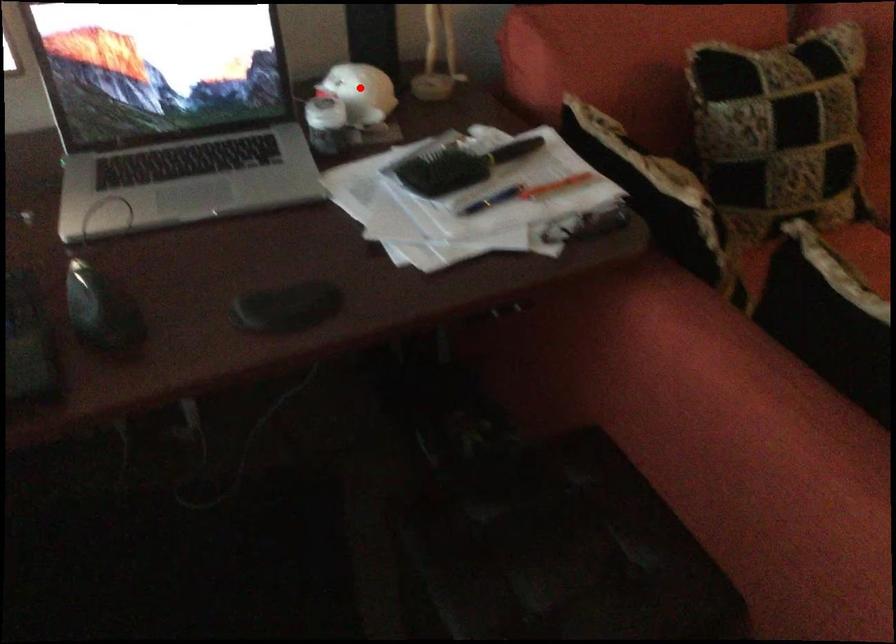
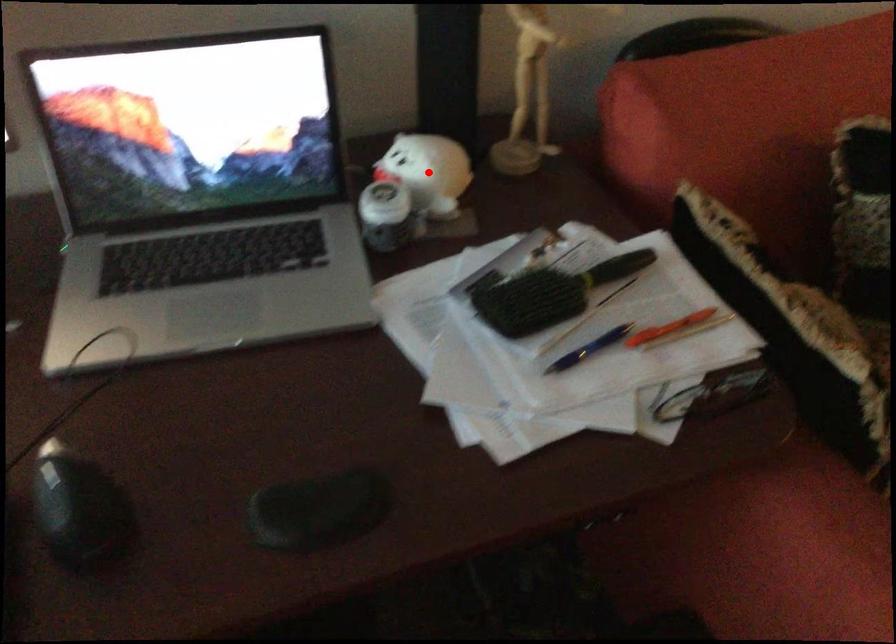
I am providing you with two images of the same scene from different viewpoints. A red point is marked on the first image and another point is marked on the second image. Does the point marked in image1 correspond to the same location as the one in image2?

Yes